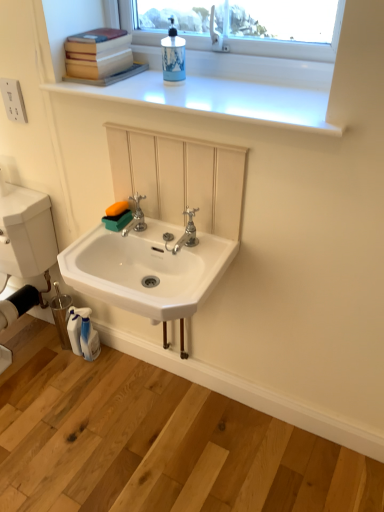
You are a GUI agent. You are given a task and a screenshot of the screen. Output one action in this format:
    pyautogui.click(x=<x>, y=<y>)
    Task: Click on the vacant area that lies between polished chrome faucet at center, positioned as the 2th tap in left-to-right order, and silver metallic faucet at center, the second tap from the right
    The width and height of the screenshot is (384, 512).
    Given the screenshot: What is the action you would take?
    pyautogui.click(x=160, y=236)